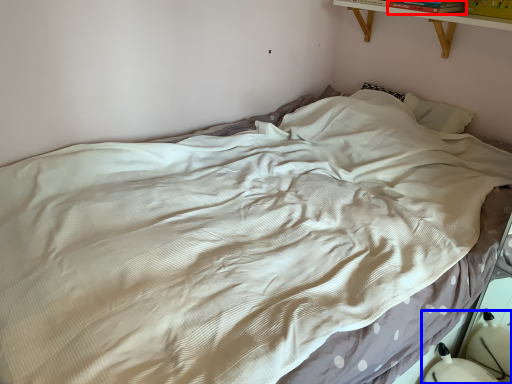
Question: Which of the following is the farthest to the observer, book (highlighted by a red box) or swivel chair (highlighted by a blue box)?

Choices:
 (A) book
 (B) swivel chair

Answer: (A)